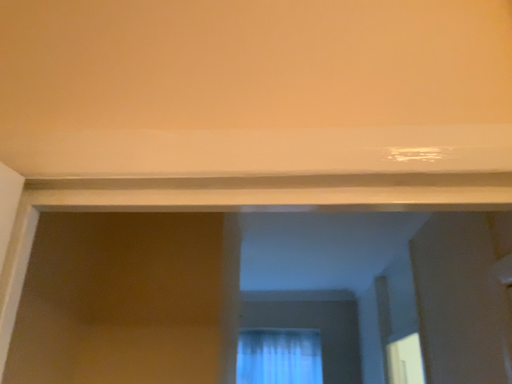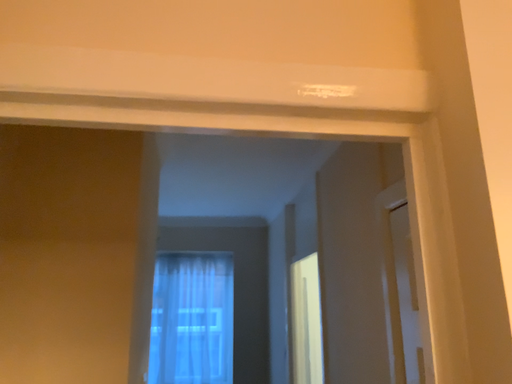
Question: Which way did the camera rotate in the video?

Choices:
 (A) rotated right
 (B) rotated left

Answer: (A)